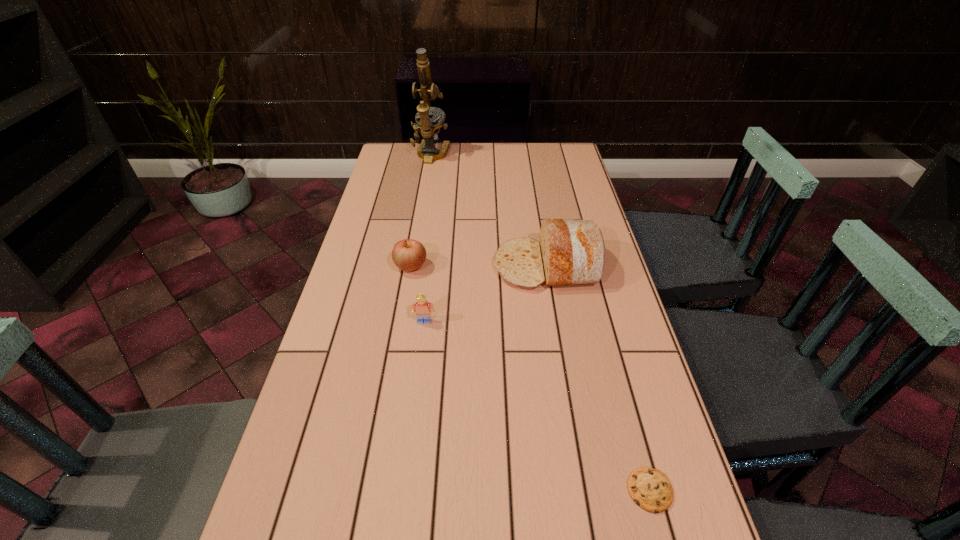
This screenshot has height=540, width=960. I want to click on the tallest object, so click(430, 127).

You are a GUI agent. You are given a task and a screenshot of the screen. Output one action in this format:
    pyautogui.click(x=<x>, y=<y>)
    Task: Click on the farthest object
    Image resolution: width=960 pixels, height=540 pixels.
    Given the screenshot: What is the action you would take?
    pyautogui.click(x=430, y=127)

Identify the location of the second tallest object. (571, 252).

The image size is (960, 540). Find the location of `apple`. apple is located at coordinates (x=408, y=255).

Find the location of `the second nearest object`. the second nearest object is located at coordinates (422, 308).

The height and width of the screenshot is (540, 960). Find the location of `the shortest object`. the shortest object is located at coordinates (650, 489).

At what (x,y) coordinates should I click in order to perform the action: click on cookie. Please return your answer as a coordinate pair (x, y). The width and height of the screenshot is (960, 540). Looking at the image, I should click on (650, 489).

At what (x,y) coordinates should I click in order to perform the action: click on free space located 0.060m on the left of the microscope. Please return your answer as a coordinate pair (x, y). The image size is (960, 540). Looking at the image, I should click on (397, 155).

Find the location of a particular element. free space located at the sliced end of the second tallest object is located at coordinates (464, 266).

Where is `blank space located at the sliced end of the second tallest object`? blank space located at the sliced end of the second tallest object is located at coordinates click(x=382, y=266).